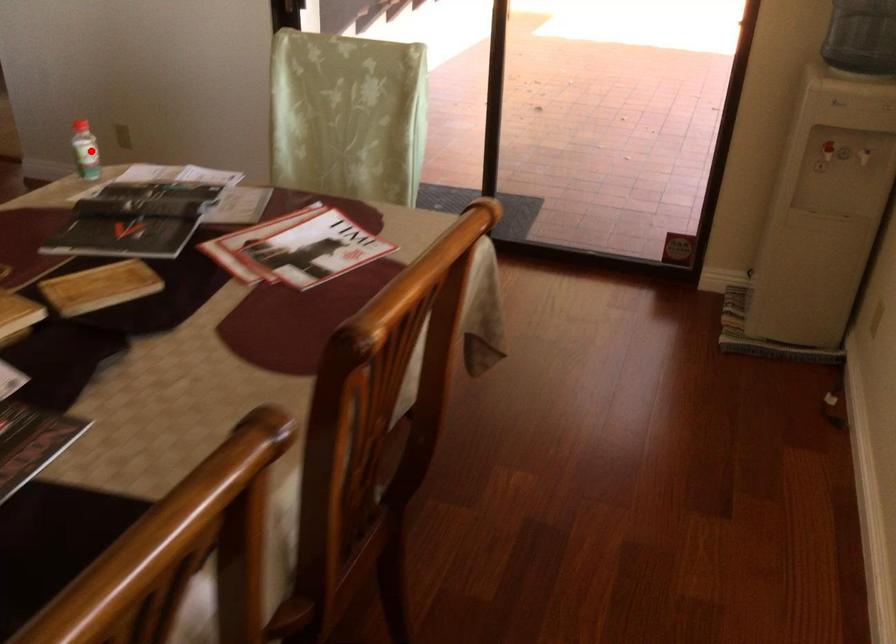
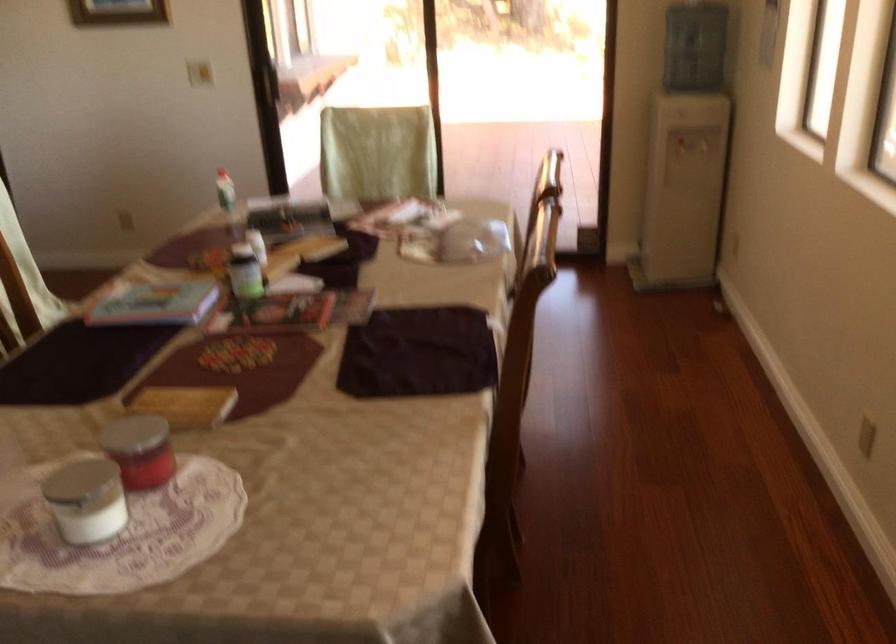
Find the pixel in the second image that matches the highlighted location in the first image.

(225, 190)